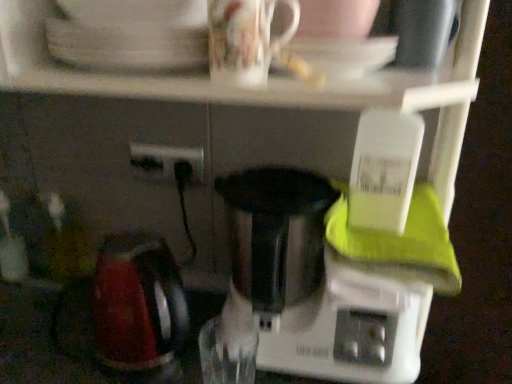
In order to face white glossy saucer at upper center, should I rotate leftwards or rightwards?

You should rotate right by 10.501 degrees.

Where is `white glossy saucer at upper center`? This screenshot has height=384, width=512. white glossy saucer at upper center is located at coordinates (344, 54).

What do you see at coordinates (170, 157) in the screenshot? I see `black plastic power plugs and sockets at center` at bounding box center [170, 157].

Identify the location of white plastic mixer at center. The width and height of the screenshot is (512, 384). (304, 293).

Is point (173, 175) farther from viewer compared to point (284, 347)?

Yes, point (173, 175) is farther from viewer.

From the picture: Which object is closer to the camera taking this photo, black plastic power plugs and sockets at center or white plastic mixer at center?

white plastic mixer at center is in front.

Locate an element on the screen. mixer on the right of black plastic power plugs and sockets at center is located at coordinates click(x=304, y=293).

Is black plastic power plugs and sockets at center oriented away from white plastic mixer at center?

black plastic power plugs and sockets at center does not have its back to white plastic mixer at center.

From a real-world perspective, which is physically below, white plastic mixer at center or white glossy saucer at upper center?

white plastic mixer at center, from a real-world perspective.

Who is bigger, white plastic mixer at center or white glossy saucer at upper center?

Bigger between the two is white plastic mixer at center.

From the image's perspective, who appears lower, white plastic mixer at center or white glossy saucer at upper center?

white plastic mixer at center, from the image's perspective.

From the image's perspective, would you say white glossy saucer at upper center is positioned over black plastic power plugs and sockets at center?

Indeed, from the image's perspective, white glossy saucer at upper center is shown above black plastic power plugs and sockets at center.

Is white glossy saucer at upper center positioned beyond the bounds of black plastic power plugs and sockets at center?

Indeed, white glossy saucer at upper center is completely outside black plastic power plugs and sockets at center.

Considering the sizes of white glossy saucer at upper center and black plastic power plugs and sockets at center in the image, is white glossy saucer at upper center wider or thinner than black plastic power plugs and sockets at center?

white glossy saucer at upper center is wider than black plastic power plugs and sockets at center.

Is white glossy saucer at upper center taller or shorter than black plastic power plugs and sockets at center?

Clearly, white glossy saucer at upper center is shorter compared to black plastic power plugs and sockets at center.

From the image's perspective, between black plastic power plugs and sockets at center and glossy ceramic mug at upper center, who is located below?

From the image's view, black plastic power plugs and sockets at center is below.

Visually, is black plastic power plugs and sockets at center positioned to the left or to the right of glossy ceramic mug at upper center?

Clearly, black plastic power plugs and sockets at center is on the left of glossy ceramic mug at upper center in the image.

Is glossy ceramic mug at upper center inside black plastic power plugs and sockets at center?

Definitely not — glossy ceramic mug at upper center is not inside black plastic power plugs and sockets at center.

Is point (163, 160) closer or farther from the camera than point (236, 25)?

Point (163, 160).

I want to click on mixer behind the glossy ceramic mug at upper center, so click(304, 293).

Considering the sizes of glossy ceramic mug at upper center and white plastic mixer at center in the image, is glossy ceramic mug at upper center taller or shorter than white plastic mixer at center?

Clearly, glossy ceramic mug at upper center is shorter compared to white plastic mixer at center.

Can you confirm if white plastic mixer at center is bigger than glossy ceramic mug at upper center?

Yes, white plastic mixer at center is bigger than glossy ceramic mug at upper center.

Is white plastic mixer at center far away from glossy ceramic mug at upper center?

No, white plastic mixer at center is in close proximity to glossy ceramic mug at upper center.

Measure the distance from white plastic mixer at center to glossy ceramic mug at upper center.

A distance of 13.47 inches exists between white plastic mixer at center and glossy ceramic mug at upper center.

Which of these two, white plastic mixer at center or glossy ceramic mug at upper center, stands taller?

white plastic mixer at center is taller.

Can you tell me how much glossy ceramic mug at upper center and white glossy saucer at upper center differ in facing direction?

glossy ceramic mug at upper center and white glossy saucer at upper center are facing 0.00235 degrees away from each other.

Between point (265, 3) and point (371, 67), which one is positioned behind?

The point (371, 67) is more distant.

Measure the distance between glossy ceramic mug at upper center and white glossy saucer at upper center.

glossy ceramic mug at upper center is 2.55 inches away from white glossy saucer at upper center.

From a real-world perspective, relative to white glossy saucer at upper center, is glossy ceramic mug at upper center vertically above or below?

In terms of real-world spatial position, glossy ceramic mug at upper center is above white glossy saucer at upper center.

What are the coordinates of `mixer located below the black plastic power plugs and sockets at center (from the image's perspective)` in the screenshot? It's located at (304, 293).

Where is `mixer located behind the white glossy saucer at upper center`? The height and width of the screenshot is (384, 512). mixer located behind the white glossy saucer at upper center is located at coordinates (304, 293).

Looking at this image, based on their spatial positions, is glossy ceramic mug at upper center or white glossy saucer at upper center further from black plastic power plugs and sockets at center?

Among the two, white glossy saucer at upper center is located further to black plastic power plugs and sockets at center.

When comparing their distances from white plastic mixer at center, does black plastic power plugs and sockets at center or white glossy saucer at upper center seem closer?

black plastic power plugs and sockets at center is closer to white plastic mixer at center.

Considering their positions, is white glossy saucer at upper center positioned closer to white plastic mixer at center than glossy ceramic mug at upper center?

Based on the image, white glossy saucer at upper center appears to be nearer to white plastic mixer at center.

Based on their spatial positions, is white plastic mixer at center or glossy ceramic mug at upper center further from white glossy saucer at upper center?

Based on the image, white plastic mixer at center appears to be further to white glossy saucer at upper center.

Considering their positions, is white glossy saucer at upper center positioned closer to glossy ceramic mug at upper center than white plastic mixer at center?

white glossy saucer at upper center lies closer to glossy ceramic mug at upper center than the other object.

Which object lies further to the anchor point white glossy saucer at upper center, black plastic power plugs and sockets at center or white plastic mixer at center?

black plastic power plugs and sockets at center is further to white glossy saucer at upper center.

Estimate the real-world distances between objects in this image. Which object is closer to glossy ceramic mug at upper center, black plastic power plugs and sockets at center or white plastic mixer at center?

white plastic mixer at center.

Based on their spatial positions, is white glossy saucer at upper center or glossy ceramic mug at upper center closer to black plastic power plugs and sockets at center?

The object closer to black plastic power plugs and sockets at center is glossy ceramic mug at upper center.

Find the location of a particular element. This screenshot has width=512, height=384. mixer positioned between white glossy saucer at upper center and black plastic power plugs and sockets at center from near to far is located at coordinates (304, 293).

Locate an element on the screen. coffee cup between white glossy saucer at upper center and white plastic mixer at center in the up-down direction is located at coordinates (245, 39).

I want to click on mixer located between glossy ceramic mug at upper center and black plastic power plugs and sockets at center in the depth direction, so click(x=304, y=293).

Where is `saucer between glossy ceramic mug at upper center and black plastic power plugs and sockets at center in the front-back direction`? The width and height of the screenshot is (512, 384). saucer between glossy ceramic mug at upper center and black plastic power plugs and sockets at center in the front-back direction is located at coordinates (344, 54).